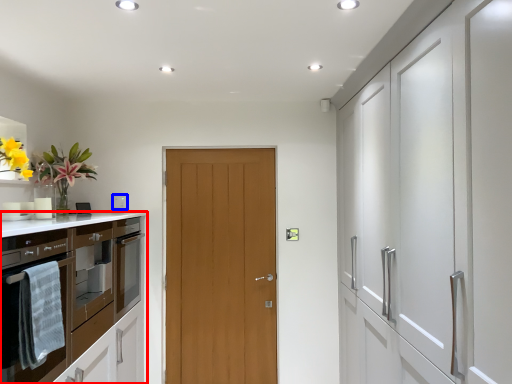
Question: Which point is closer to the camera, cabinetry (highlighted by a red box) or appliance (highlighted by a blue box)?

Choices:
 (A) cabinetry
 (B) appliance

Answer: (A)